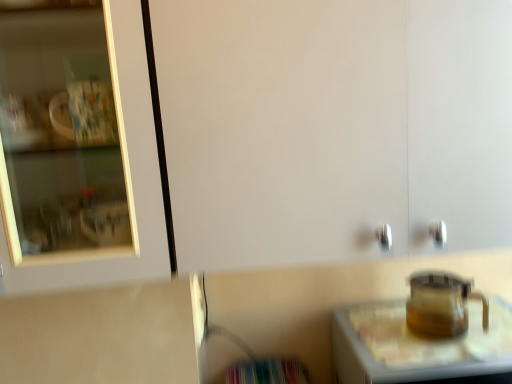
Image resolution: width=512 pixels, height=384 pixels. I want to click on free space above transparent glass table at lower right (from a real-world perspective), so click(460, 342).